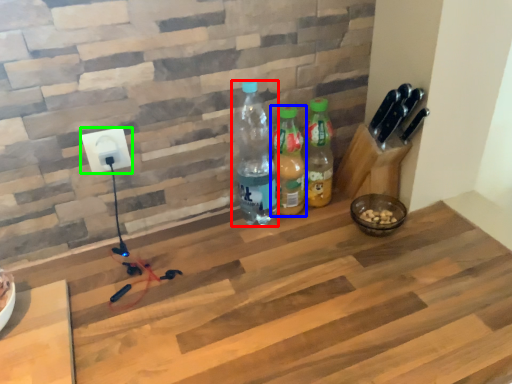
Question: Which object is positioned farthest from bottle (highlighted by a red box)? Select from bottle (highlighted by a blue box) and power plugs and sockets (highlighted by a green box).

Choices:
 (A) bottle
 (B) power plugs and sockets

Answer: (B)